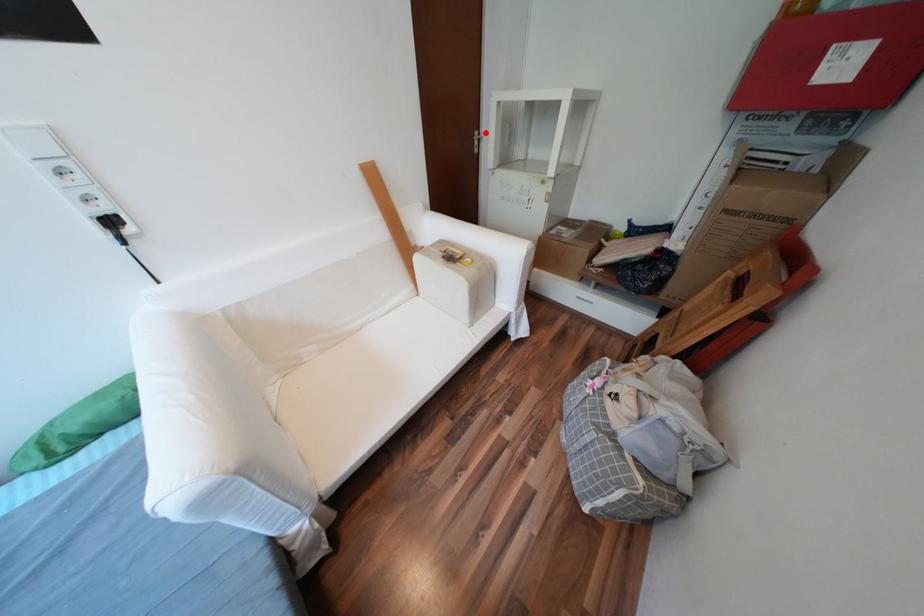
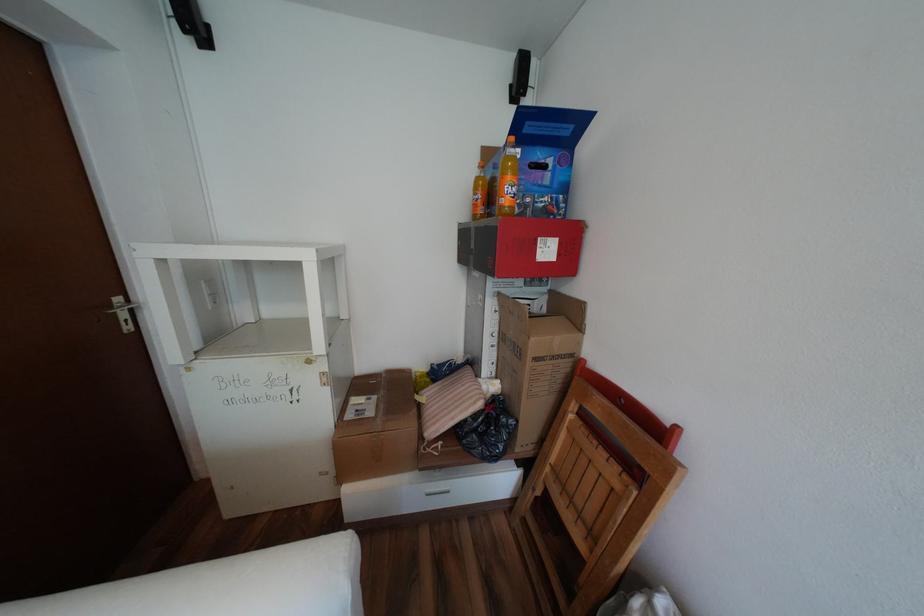
Question: I am providing you with two images of the same scene from different viewpoints. A red point is marked on the first image. Can you still see the location of the red point in image 2?

Choices:
 (A) Yes
 (B) No

Answer: (A)